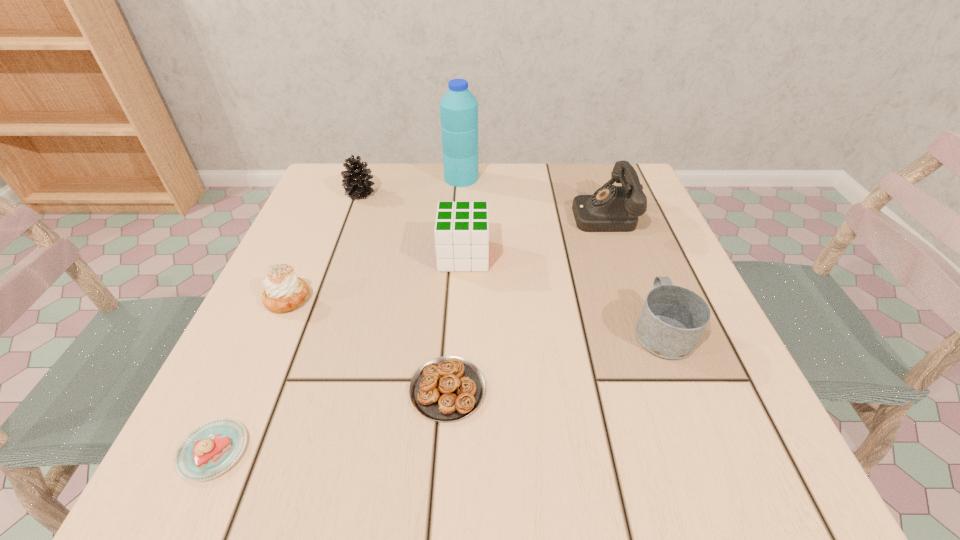
In the image, there is a desktop. At what (x,y) coordinates should I click in order to perform the action: click on free space at the near edge. Please return your answer as a coordinate pair (x, y). Looking at the image, I should click on (454, 482).

Locate an element on the screen. The image size is (960, 540). vacant space at the left edge of the desktop is located at coordinates (246, 328).

Where is `free space at the right edge of the desktop`? This screenshot has height=540, width=960. free space at the right edge of the desktop is located at coordinates (694, 361).

In the image, there is a desktop. At what (x,y) coordinates should I click in order to perform the action: click on free space at the far left corner. Please return your answer as a coordinate pair (x, y). The width and height of the screenshot is (960, 540). Looking at the image, I should click on (386, 174).

The height and width of the screenshot is (540, 960). In order to click on empty location between the rightmost pastry and the tallest pastry in this screenshot , I will do `click(368, 345)`.

You are a GUI agent. You are given a task and a screenshot of the screen. Output one action in this format:
    pyautogui.click(x=<x>, y=<y>)
    Task: Click on the free space that is in between the cube and the tallest pastry
    The height and width of the screenshot is (540, 960).
    Given the screenshot: What is the action you would take?
    pyautogui.click(x=375, y=278)

At what (x,y) coordinates should I click in order to perform the action: click on free space that is in between the telephone and the tallest object. Please return your answer as a coordinate pair (x, y). Looking at the image, I should click on (532, 196).

What are the coordinates of `free space between the telephone and the cube` in the screenshot? It's located at (533, 235).

Locate an element on the screen. Image resolution: width=960 pixels, height=540 pixels. vacant space in between the shortest pastry and the farthest pastry is located at coordinates (251, 375).

The height and width of the screenshot is (540, 960). Find the location of `free space between the shortest pastry and the water bottle`. free space between the shortest pastry and the water bottle is located at coordinates (337, 314).